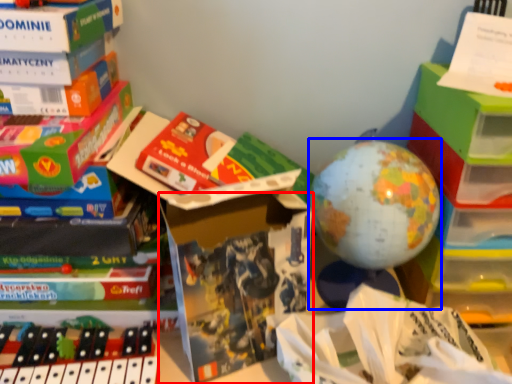
Question: Which object appears farthest to the camera in this image, paperback book (highlighted by a red box) or toy (highlighted by a blue box)?

Choices:
 (A) paperback book
 (B) toy

Answer: (B)